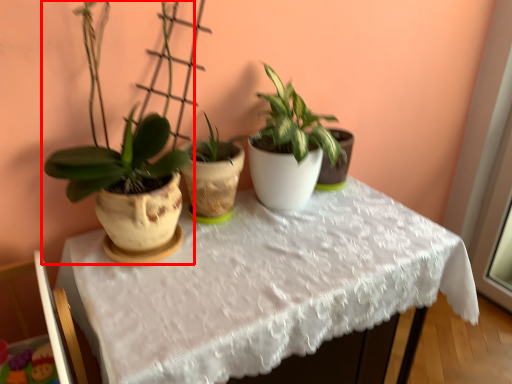
Question: Considering the relative positions of houseplant (annotated by the red box) and table in the image provided, where is houseplant (annotated by the red box) located with respect to the staircase?

Choices:
 (A) left
 (B) right

Answer: (A)